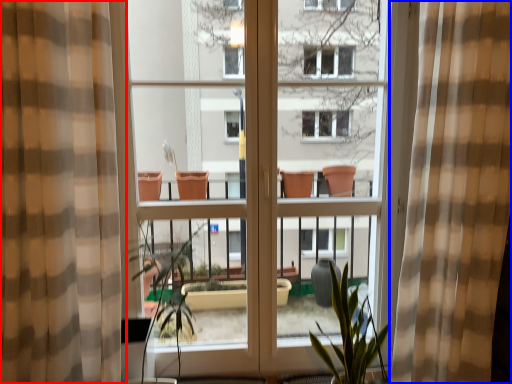
Question: Among these objects, which one is farthest to the camera, curtain (highlighted by a red box) or curtain (highlighted by a blue box)?

Choices:
 (A) curtain
 (B) curtain

Answer: (B)